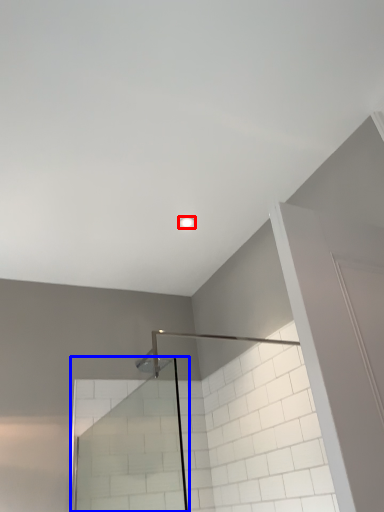
Question: Which of the following is the farthest to the observer, light fixture (highlighted by a red box) or glass door (highlighted by a blue box)?

Choices:
 (A) light fixture
 (B) glass door

Answer: (A)